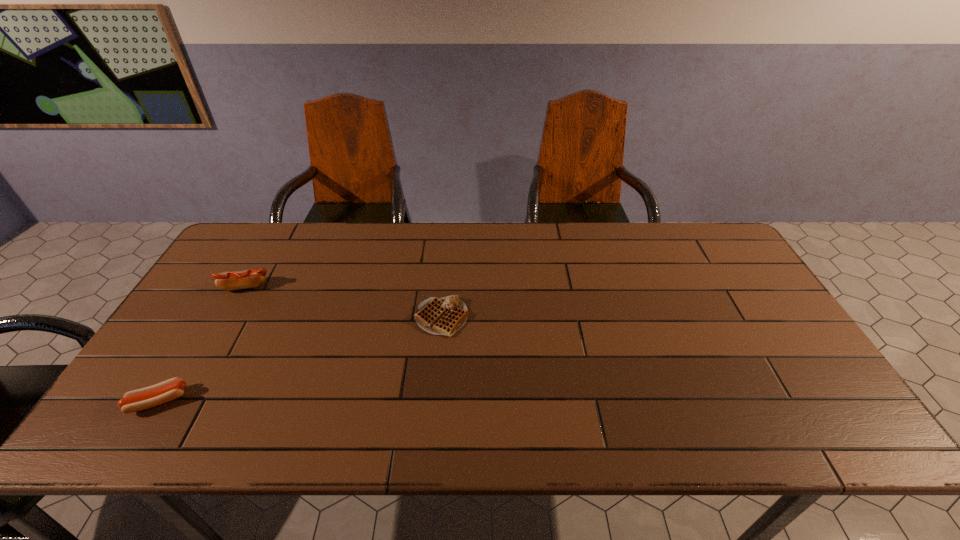
I want to click on the farther sausage, so click(x=251, y=278).

This screenshot has width=960, height=540. Identify the location of the tallest object. (251, 278).

At what (x,y) coordinates should I click in order to perform the action: click on the second tallest object. Please return your answer as a coordinate pair (x, y). This screenshot has width=960, height=540. Looking at the image, I should click on (148, 397).

At what (x,y) coordinates should I click in order to perform the action: click on the nearest object. Please return your answer as a coordinate pair (x, y). This screenshot has height=540, width=960. Looking at the image, I should click on (148, 397).

Find the location of a particular element. the rightmost object is located at coordinates (441, 316).

Where is `the second nearest object`? This screenshot has width=960, height=540. the second nearest object is located at coordinates (441, 316).

You are a GUI agent. You are given a task and a screenshot of the screen. Output one action in this format:
    pyautogui.click(x=<x>, y=<y>)
    Task: Click on the vacant space positioned on the right of the farthest object
    Image resolution: width=960 pixels, height=540 pixels.
    Given the screenshot: What is the action you would take?
    pyautogui.click(x=387, y=287)

Identify the location of free space located on the back of the nearer sausage. (211, 315).

At what (x,y) coordinates should I click in order to perform the action: click on vacant space located on the back of the shortest object. Please return your answer as a coordinate pair (x, y). Looking at the image, I should click on (450, 226).

This screenshot has height=540, width=960. I want to click on object situated at the near edge, so click(x=148, y=397).